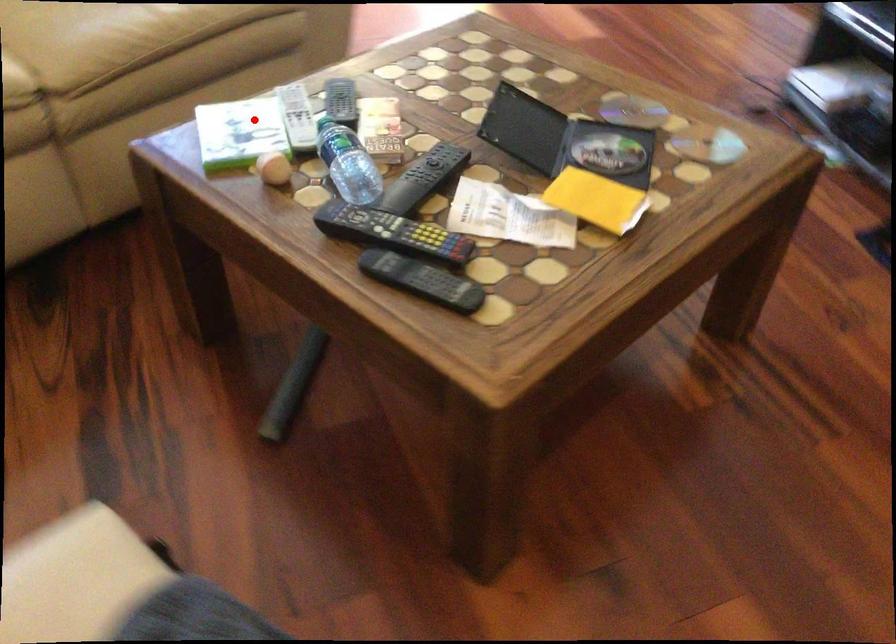
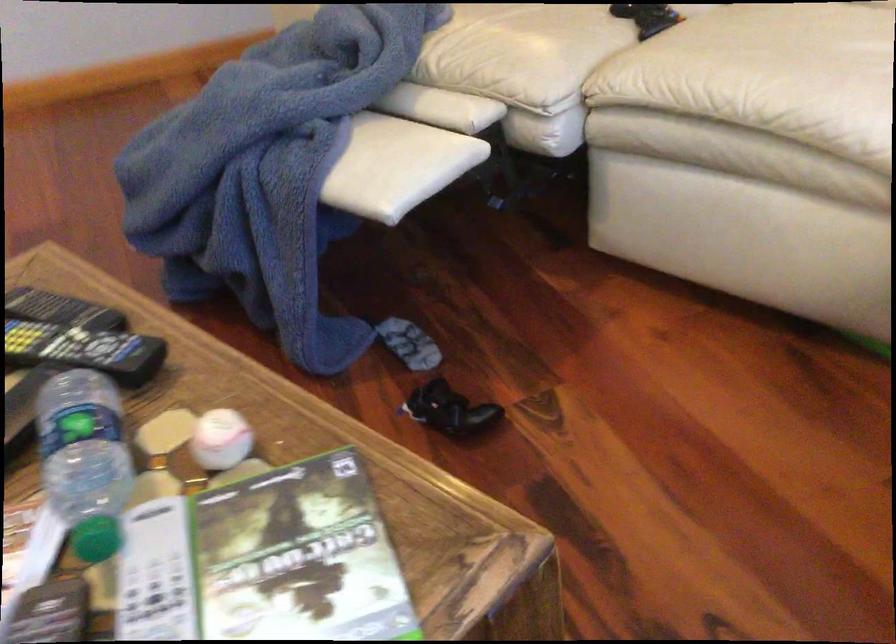
Locate, in the second image, the point that corresponds to the highlighted location in the first image.

(298, 556)